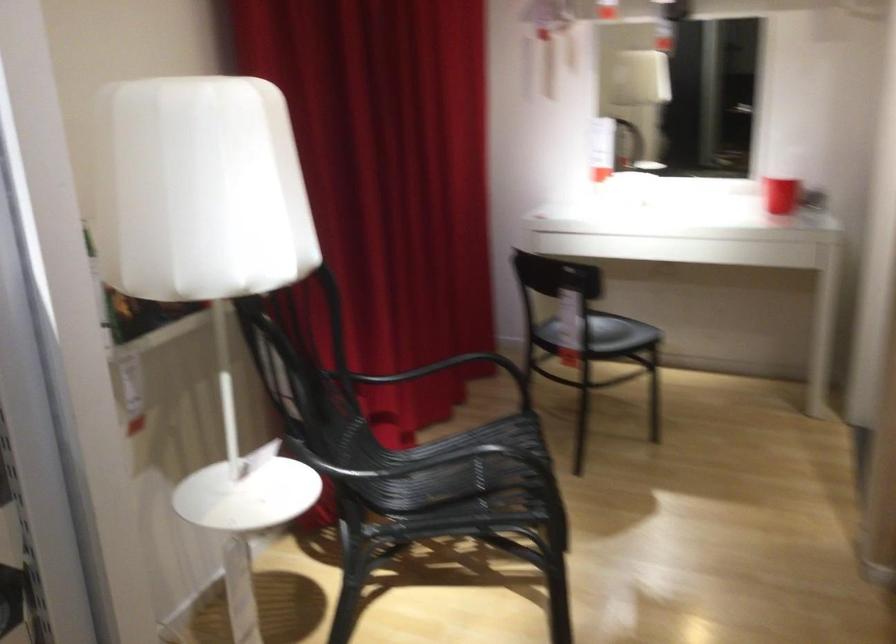
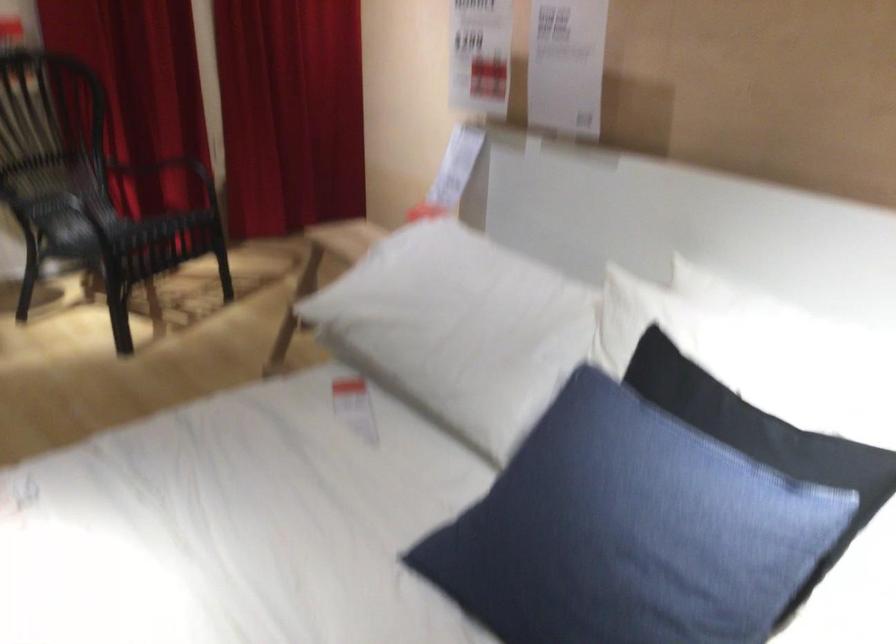
In the second image, find the point that corresponds to point 394,386 in the first image.

(176, 169)